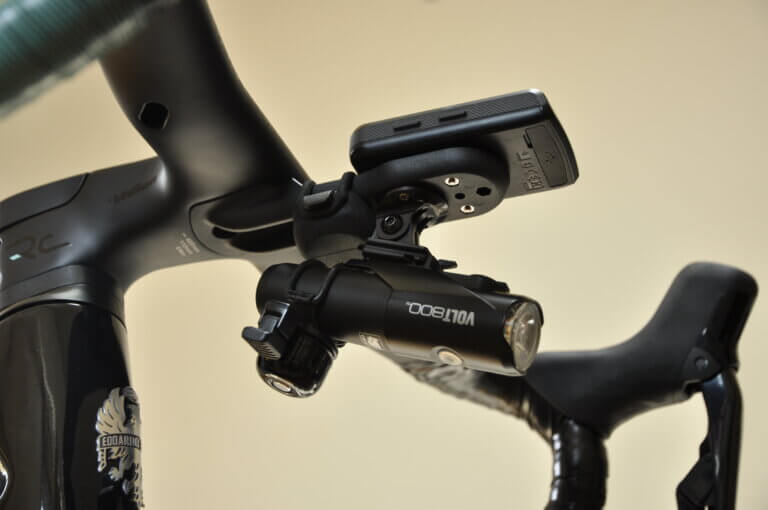
At what (x,y) coordinates should I click in order to perform the action: click on mounting bracket. Please return your answer as a coordinate pair (x, y). Looking at the image, I should click on [399, 253].